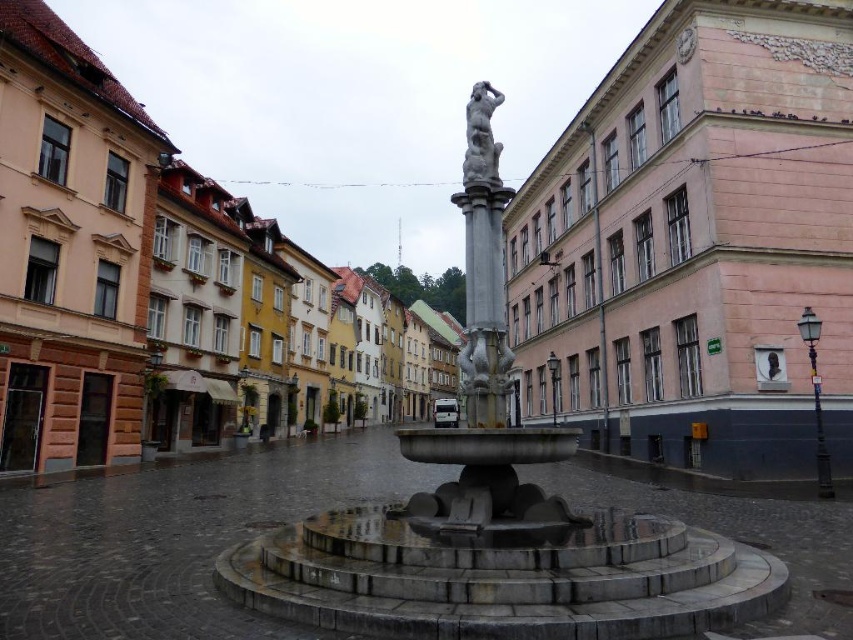
Consider the image. Between polished stone column at center and slate gray statue at center, which one is positioned lower?

polished stone column at center is below.

I want to click on polished stone column at center, so click(x=485, y=307).

Which is more to the right, slate gray statue at center or matte black bust at center?

From the viewer's perspective, matte black bust at center appears more on the right side.

Who is positioned more to the left, slate gray statue at center or matte black bust at center?

slate gray statue at center

The height and width of the screenshot is (640, 853). What do you see at coordinates (480, 136) in the screenshot? I see `slate gray statue at center` at bounding box center [480, 136].

This screenshot has width=853, height=640. Find the location of `slate gray statue at center`. slate gray statue at center is located at coordinates (480, 136).

Who is higher up, polished stone column at center or matte black bust at center?

polished stone column at center

From the picture: Does polished stone column at center have a lesser width compared to matte black bust at center?

No.

This screenshot has width=853, height=640. What do you see at coordinates (485, 307) in the screenshot?
I see `polished stone column at center` at bounding box center [485, 307].

This screenshot has height=640, width=853. What are the coordinates of `polished stone column at center` in the screenshot? It's located at (x=485, y=307).